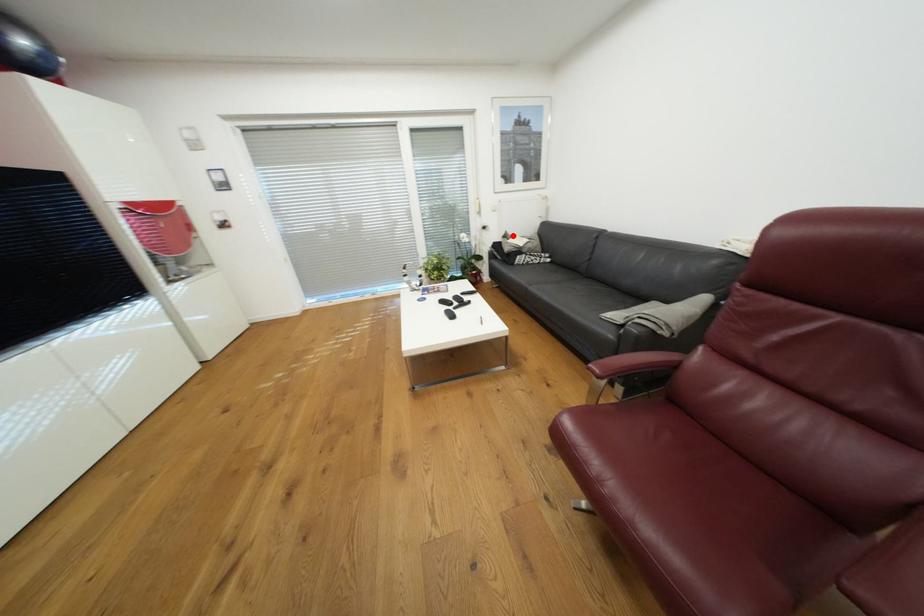
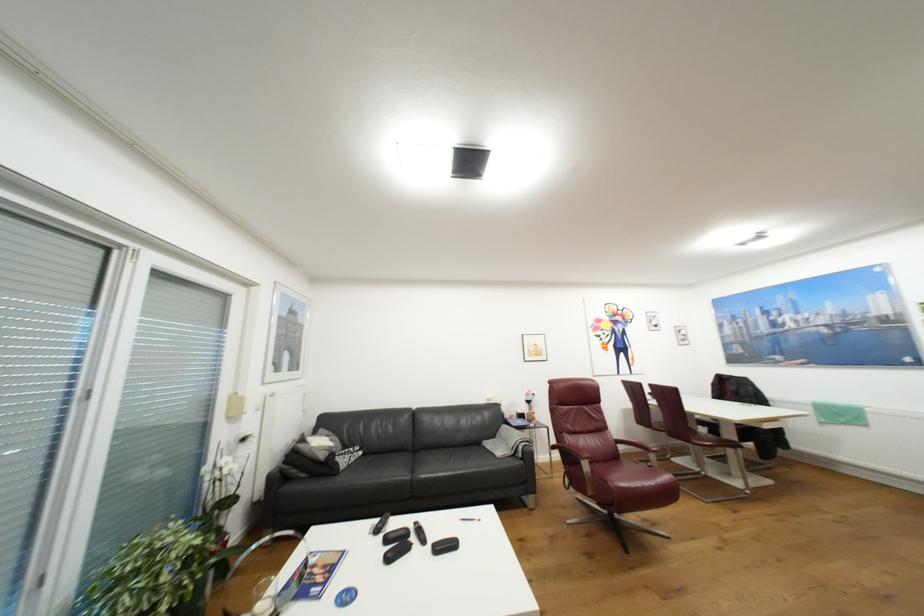
Question: I am providing you with two images of the same scene from different viewpoints. Image1 has a red point marked. In image2, the corresponding 3D location appears at what relative position? Reply with the corresponding letter.

Choices:
 (A) Closer
 (B) Farther

Answer: (B)